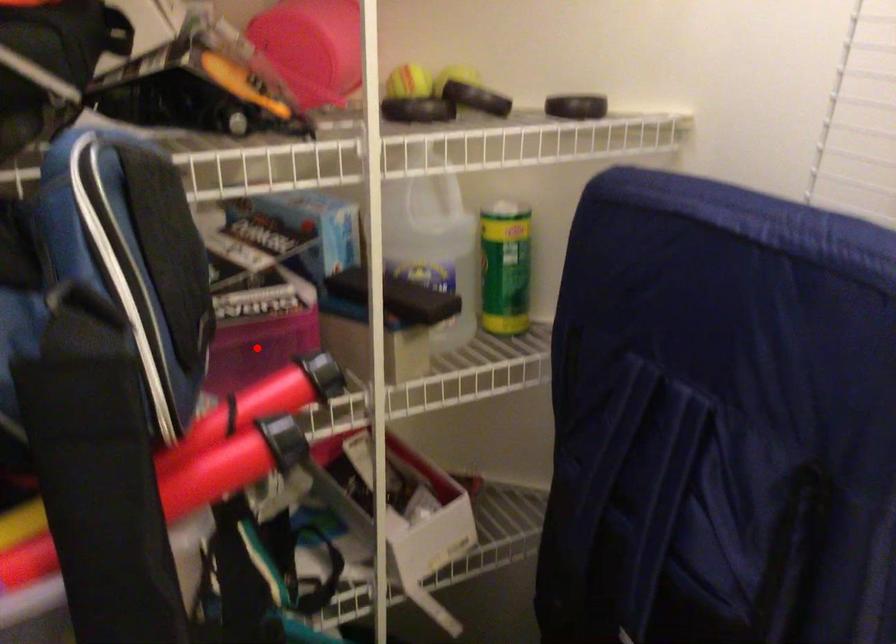
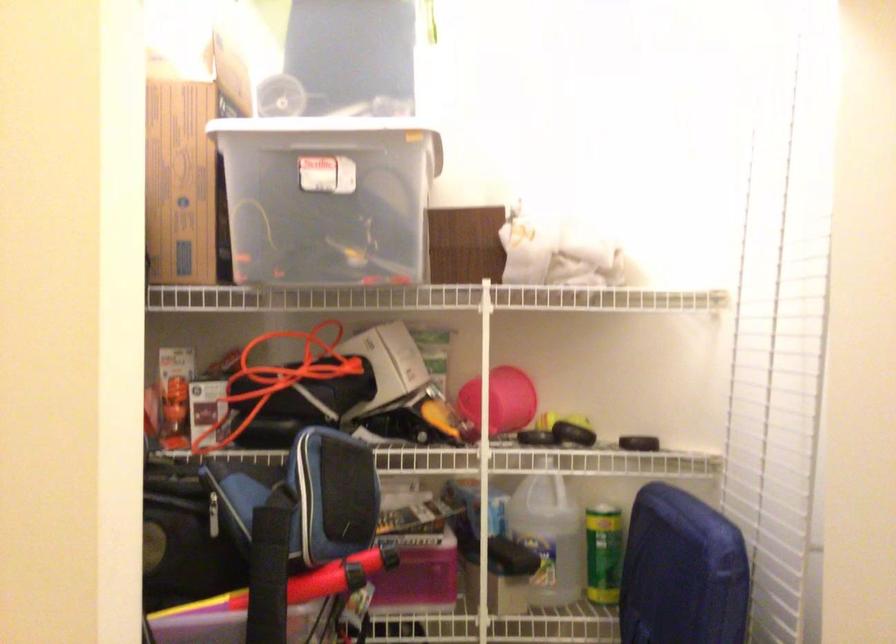
In the second image, find the point that corresponds to the highlighted location in the first image.

(418, 574)